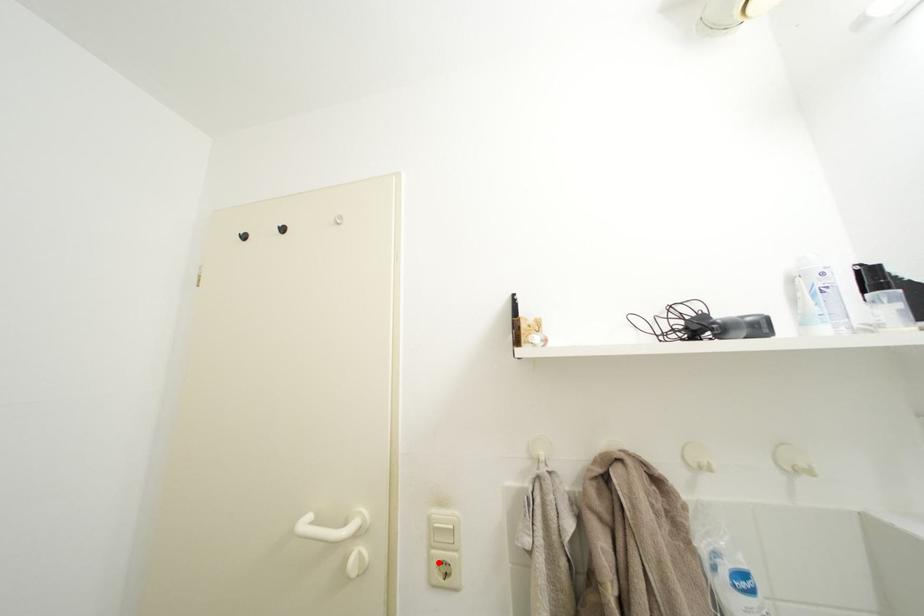
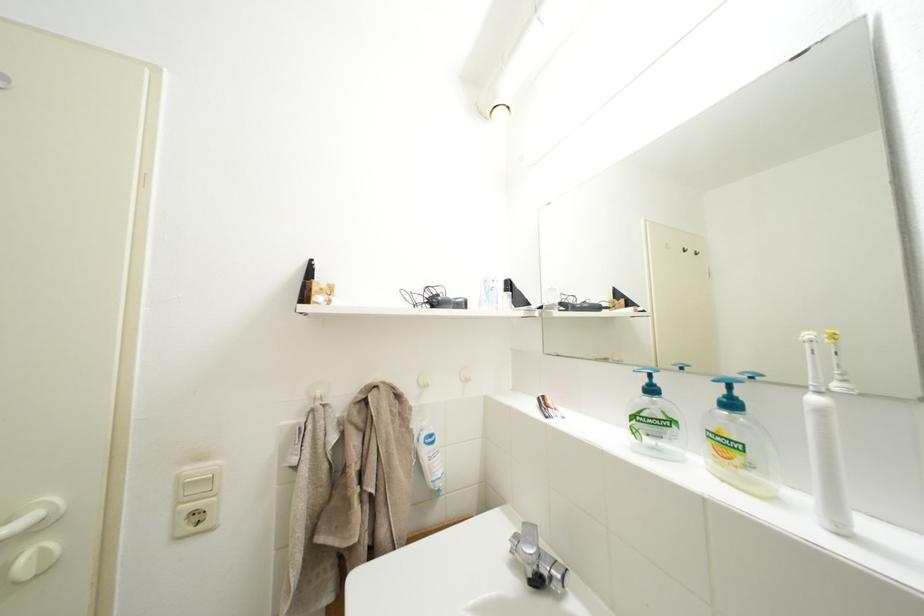
The point at the highlighted location is marked in the first image. Where is the corresponding point in the second image?

(185, 519)